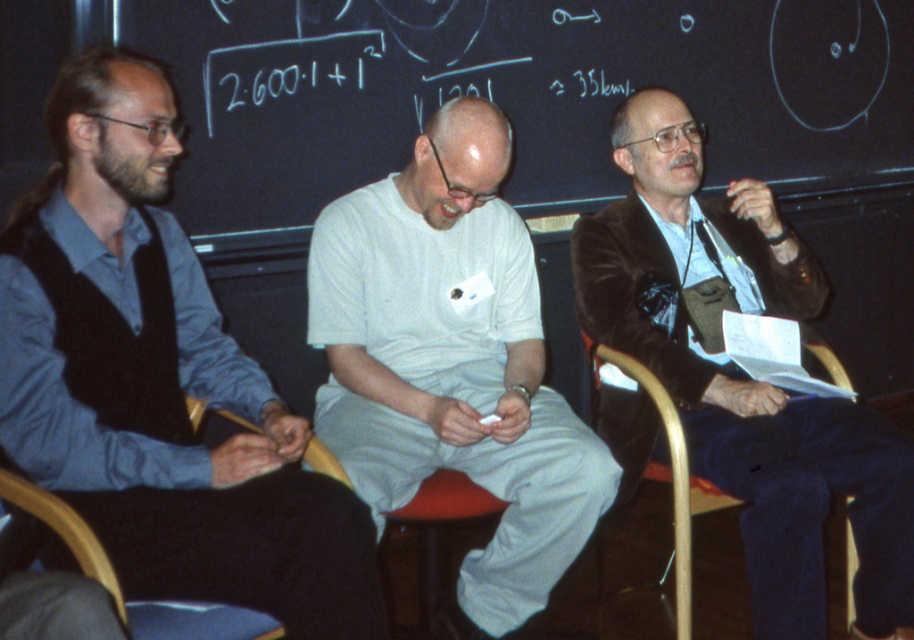
You are a tailor who needs to determine if the velvet brown jacket at center can be placed on the wooden chair at lower right without falling off. Based on their sizes, can the jacket fit on the chair?

The velvet brown jacket at center is wider than the wooden chair at lower right, so placing it might cause it to hang off the edges and potentially fall off.

In the scene shown: You are a photographer standing at the front of the classroom. You want to take a closeup shot of the white cotton shirt at center. Considering your current position, can you estimate whether you need to move closer or farther away to achieve the desired closeup?

The white cotton shirt at center is 1.98 meters away from the camera. To take a closeup, you would need to move closer to reduce the distance between the camera and the subject.

You are a tailor who needs to determine which garment requires less fabric to alter. Given the white cotton shirt at center and the velvet brown jacket at center, which one would you choose?

The white cotton shirt at center is thinner than the velvet brown jacket at center, so it requires less fabric to alter.